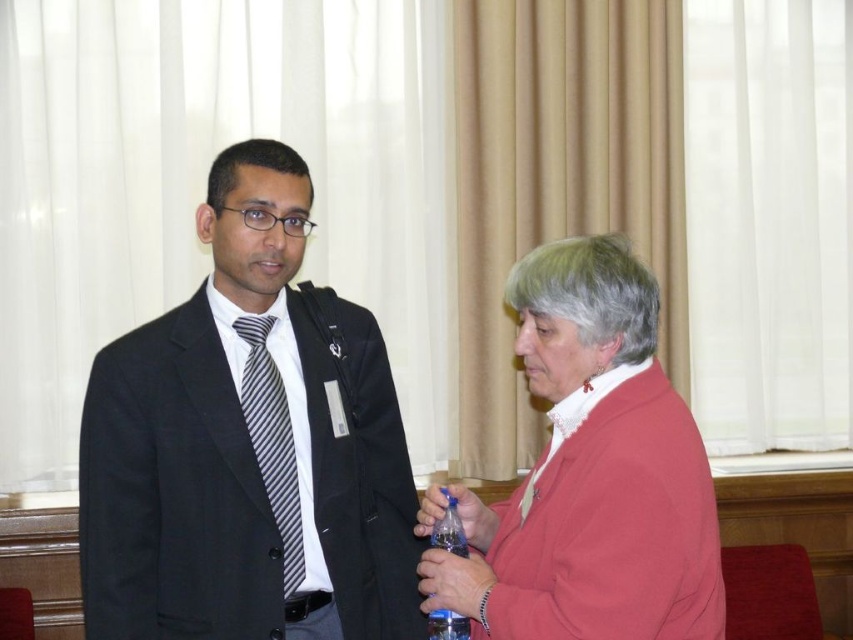
You are designing a layout for a magazine article about professional attire. The image shows a person wearing a matte black suit at left and a striped fabric tie at left. Based on the visual hierarchy principles, which item should be highlighted first in the article to emphasize dominance?

The matte black suit at left should be highlighted first because it has a greater height compared to the striped fabric tie at left, making it more dominant in the visual hierarchy.

You are a photographer setting up for a group photo. You need to arrange the matte black suit at left and the matte red jacket at right so that both are visible in the frame. Given their heights, which person should stand closer to the camera to ensure their faces are equally visible?

The matte red jacket at right should stand closer to the camera because the matte black suit at left is taller than the matte red jacket at right, so adjusting their positions will balance their visibility in the photo.

You are organizing a photo shoot and need to arrange two outfits for a catalog. The matte black suit at left and the matte red jacket at right must be displayed side by side. Given their sizes, which outfit should be placed on the larger mannequin?

The matte black suit at left should be placed on the larger mannequin because it is larger in size than the matte red jacket at right.